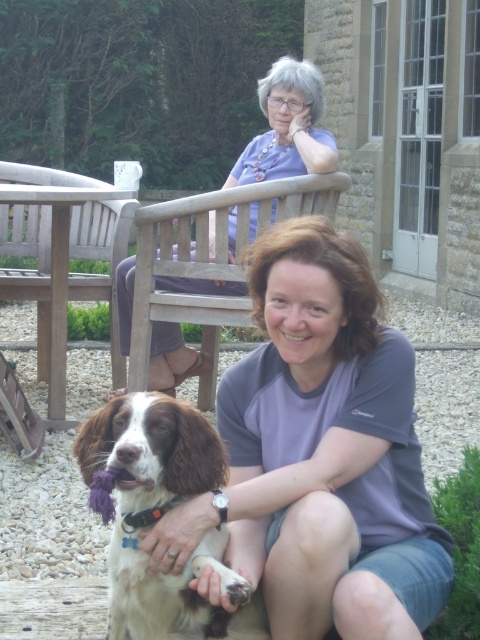
You are standing in the park and see the wooden park bench at upper center and the matte purple blouse at upper center. Which object is closer to you?

The wooden park bench at upper center is closer to you because the matte purple blouse at upper center is behind it.

From the picture: You are standing at the point labeled point (201, 556) and want to walk to the point labeled point (11, 163). Which direction should you move to get closer to your destination?

To move from point (201, 556) to point (11, 163), you should move downward and to the left since point (11, 163) is located below and to the left of point (201, 556).